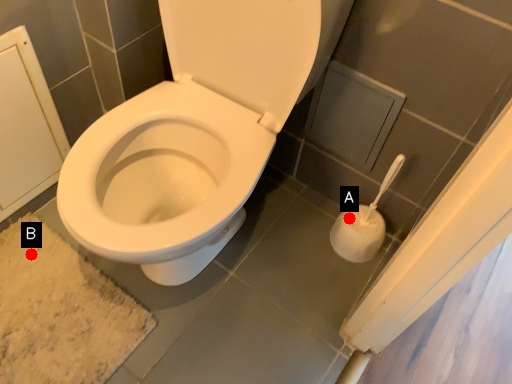
Question: Two points are circled on the image, labeled by A and B beside each circle. Which of the following is the farthest from the observer?

Choices:
 (A) A is further
 (B) B is further

Answer: (A)